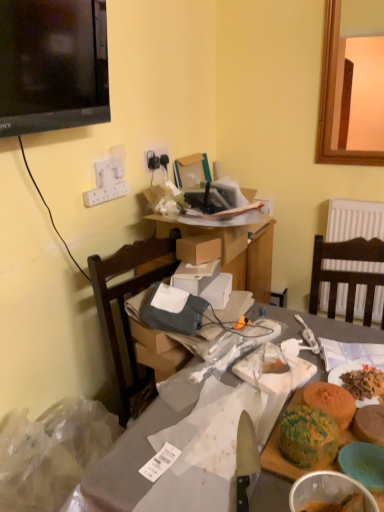
The image size is (384, 512). In order to click on vacant point above matte gray table at center, placed as the second table when sorted from top to bottom (from a real-world perspective) in this screenshot , I will do `click(211, 429)`.